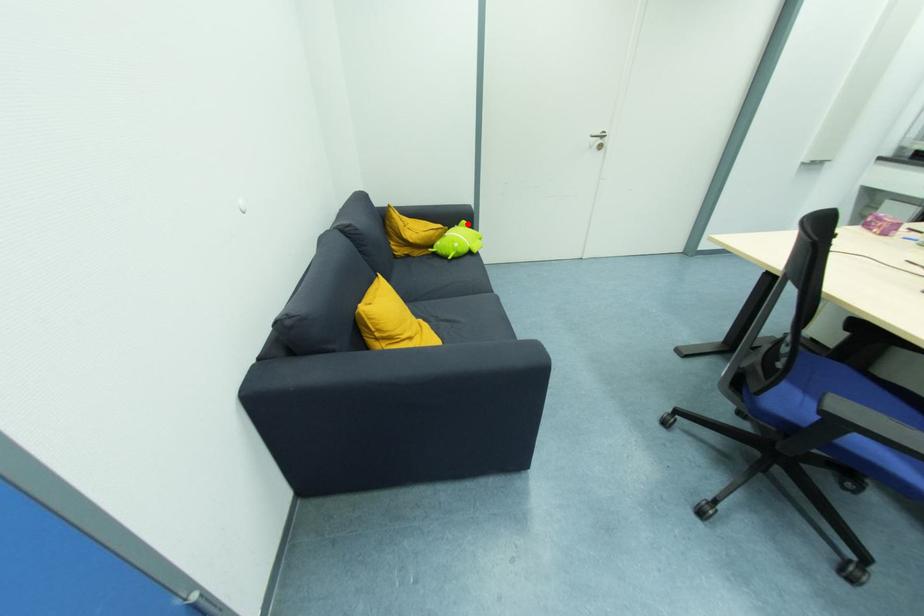
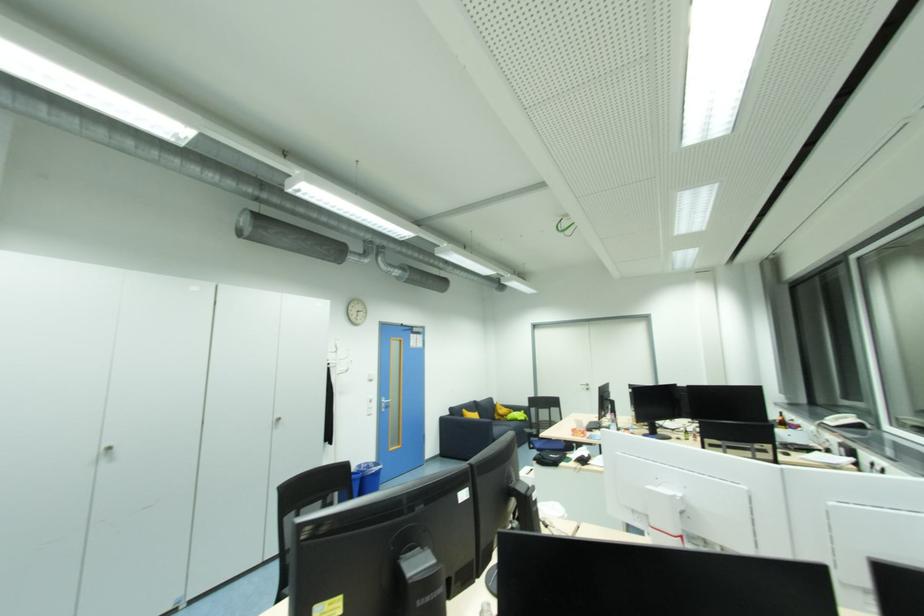
Question: I am providing you with two images of the same scene from different viewpoints. In image1, a red point is highlighted. Considering the same 3D point in image2, which of the following is correct?

Choices:
 (A) It is closer
 (B) It is farther

Answer: (B)